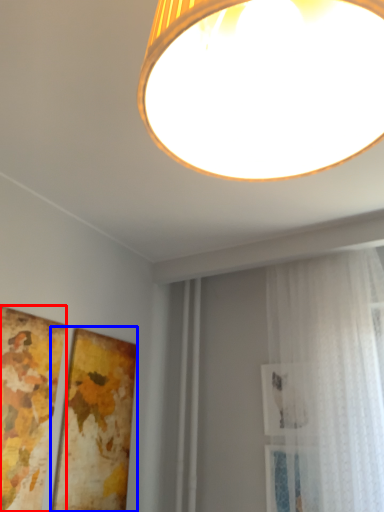
Question: Which point is closer to the camera, picture frame (highlighted by a red box) or picture frame (highlighted by a blue box)?

Choices:
 (A) picture frame
 (B) picture frame

Answer: (A)